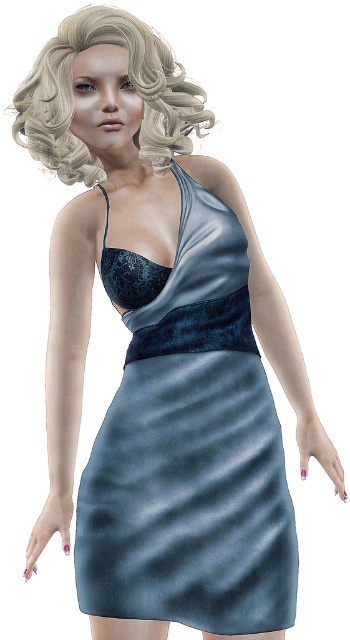
Question: Is the position of satin dress at center less distant than that of blonde curly hair at upper left?

Choices:
 (A) no
 (B) yes

Answer: (A)

Question: Is satin dress at center to the right of blonde curly hair at upper left from the viewer's perspective?

Choices:
 (A) no
 (B) yes

Answer: (B)

Question: Where is satin dress at center located in relation to blonde curly hair at upper left in the image?

Choices:
 (A) right
 (B) left

Answer: (A)

Question: Which of the following is the closest to the observer?

Choices:
 (A) (130, 276)
 (B) (95, 28)

Answer: (B)